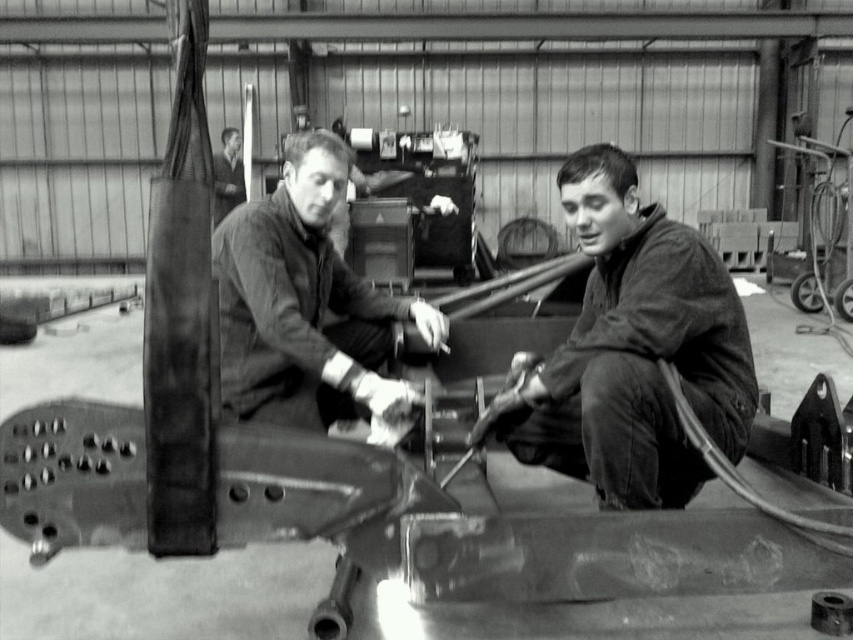
Question: Does matte black jacket at center have a greater width compared to smooth leather jacket at upper left?

Choices:
 (A) no
 (B) yes

Answer: (B)

Question: Does matte black jacket at lower right appear under smooth leather jacket at upper left?

Choices:
 (A) yes
 (B) no

Answer: (A)

Question: Which point is farther to the camera?

Choices:
 (A) [216, 241]
 (B) [549, 458]
 (C) [241, 192]

Answer: (C)

Question: Is matte black jacket at lower right further to the viewer compared to matte black jacket at center?

Choices:
 (A) yes
 (B) no

Answer: (B)

Question: Estimate the real-world distances between objects in this image. Which object is closer to the matte black jacket at lower right?

Choices:
 (A) matte black jacket at center
 (B) smooth leather jacket at upper left

Answer: (A)

Question: Estimate the real-world distances between objects in this image. Which object is closer to the matte black jacket at center?

Choices:
 (A) matte black jacket at lower right
 (B) smooth leather jacket at upper left

Answer: (A)